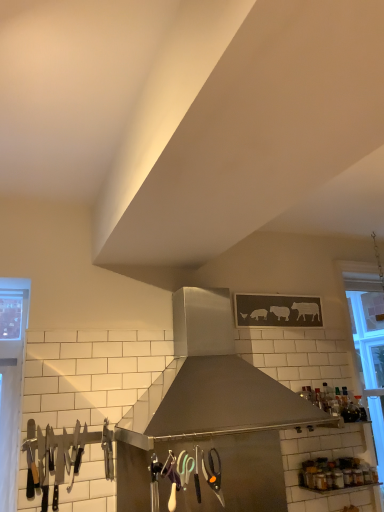
Question: Is stainless steel range hood at center at the left side of transparent glass bottle at upper right?

Choices:
 (A) yes
 (B) no

Answer: (A)

Question: Considering the relative sizes of stainless steel range hood at center and transparent glass bottle at upper right in the image provided, is stainless steel range hood at center smaller than transparent glass bottle at upper right?

Choices:
 (A) no
 (B) yes

Answer: (A)

Question: Does stainless steel range hood at center have a greater width compared to transparent glass bottle at upper right?

Choices:
 (A) yes
 (B) no

Answer: (A)

Question: From the image's perspective, does stainless steel range hood at center appear lower than transparent glass bottle at upper right?

Choices:
 (A) yes
 (B) no

Answer: (B)

Question: Does stainless steel range hood at center appear on the right side of transparent glass bottle at upper right?

Choices:
 (A) yes
 (B) no

Answer: (B)

Question: Looking at their shapes, would you say stainless steel range hood at center is wider or thinner than polished stainless steel knives at left?

Choices:
 (A) wide
 (B) thin

Answer: (A)

Question: Is stainless steel range hood at center bigger or smaller than polished stainless steel knives at left?

Choices:
 (A) big
 (B) small

Answer: (A)

Question: In the image, is stainless steel range hood at center positioned in front of or behind polished stainless steel knives at left?

Choices:
 (A) behind
 (B) front

Answer: (B)

Question: Does point (178, 409) appear closer or farther from the camera than point (56, 470)?

Choices:
 (A) farther
 (B) closer

Answer: (B)

Question: Considering the positions of stainless steel range hood at center and clear glass window at right in the image, is stainless steel range hood at center taller or shorter than clear glass window at right?

Choices:
 (A) tall
 (B) short

Answer: (B)

Question: From a real-world perspective, relative to clear glass window at right, is stainless steel range hood at center vertically above or below?

Choices:
 (A) above
 (B) below

Answer: (A)

Question: Is stainless steel range hood at center in front of or behind clear glass window at right in the image?

Choices:
 (A) front
 (B) behind

Answer: (A)

Question: Considering the relative positions of stainless steel range hood at center and clear glass window at right in the image provided, is stainless steel range hood at center to the left or to the right of clear glass window at right?

Choices:
 (A) left
 (B) right

Answer: (A)

Question: Considering the positions of polished stainless steel knives at left and clear glass window at right in the image, is polished stainless steel knives at left taller or shorter than clear glass window at right?

Choices:
 (A) tall
 (B) short

Answer: (B)

Question: Would you say polished stainless steel knives at left is inside or outside clear glass window at right?

Choices:
 (A) inside
 (B) outside

Answer: (B)